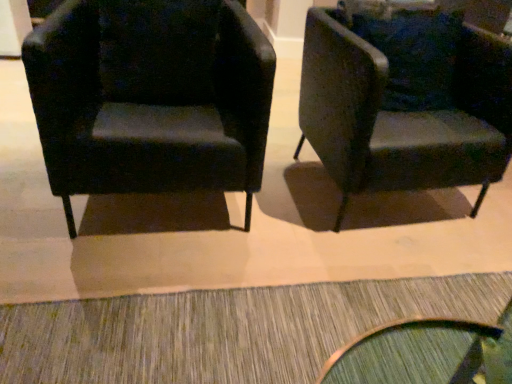
The width and height of the screenshot is (512, 384). What are the coordinates of `free space between matte black armchair at left, acting as the first chair starting from the left, and textured gray doormat at lower center` in the screenshot? It's located at (252, 247).